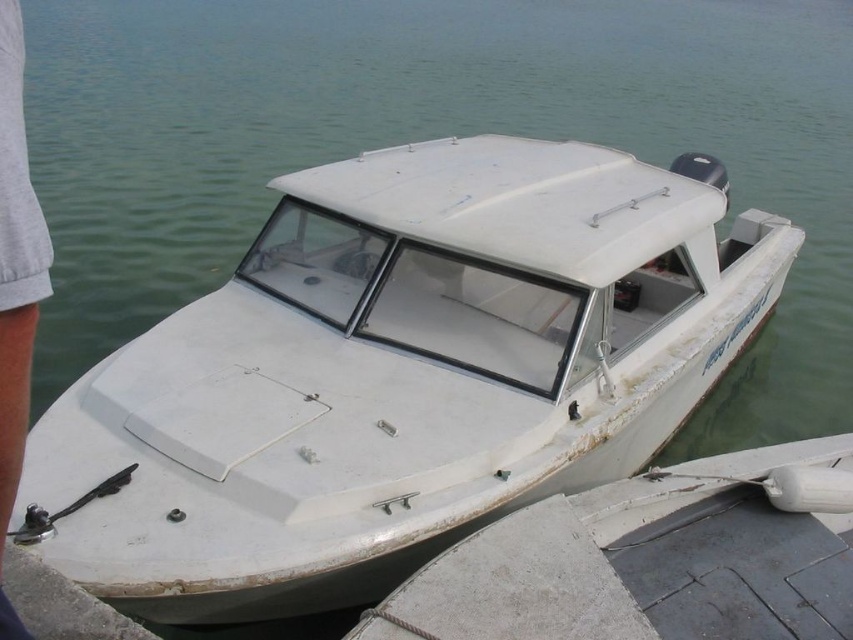
Based on the photo, which is more to the left, white matte boat at center or gray cotton pants at lower left?

Positioned to the left is gray cotton pants at lower left.

Between point (354, 369) and point (9, 408), which one is positioned in front?

Point (9, 408)

Between point (515, 296) and point (9, 253), which one is positioned in front?

Point (9, 253)

The height and width of the screenshot is (640, 853). I want to click on white matte boat at center, so click(399, 372).

Based on the photo, can you confirm if gray concrete dock at lower right is smaller than gray cotton pants at lower left?

No.

Who is more forward, (735, 518) or (15, 173)?

Point (15, 173) is more forward.

Find the location of a particular element. gray concrete dock at lower right is located at coordinates (653, 557).

Describe the element at coordinates (399, 372) in the screenshot. I see `white matte boat at center` at that location.

Is white matte boat at center thinner than gray concrete dock at lower right?

No.

Is point (94, 394) positioned in front of point (474, 612)?

No, it is not.

Where is `white matte boat at center`? white matte boat at center is located at coordinates (399, 372).